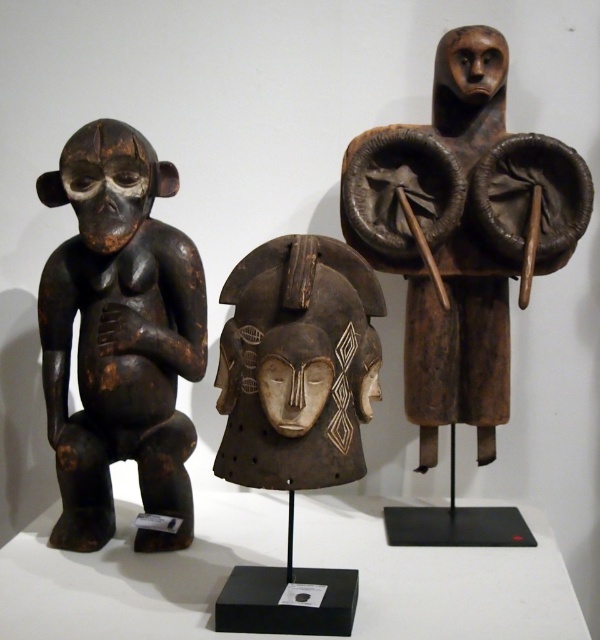
Locate an element on the screen. The image size is (600, 640). brown wooden figure at upper right is located at coordinates (462, 257).

Is point (459, 67) positioned behind point (289, 387)?

Yes.

Measure the distance between brown wooden figure at upper right and camera.

5.04 feet

Locate an element on the screen. Image resolution: width=600 pixels, height=640 pixels. brown wooden figure at upper right is located at coordinates (462, 257).

Is point (445, 531) behind point (69, 188)?

Yes, it is behind point (69, 188).

Is point (411, 152) more distant than point (102, 289)?

Yes, point (411, 152) is farther from viewer.

Locate an element on the screen. Image resolution: width=600 pixels, height=640 pixels. brown wooden figure at upper right is located at coordinates (462, 257).

Does point (126, 428) come in front of point (282, 429)?

That is False.

Can you confirm if dark brown wood figure at left is shorter than dark brown wood mask at center?

In fact, dark brown wood figure at left may be taller than dark brown wood mask at center.

Does point (109, 348) lie in front of point (352, 429)?

No, it is behind (352, 429).

Where is `dark brown wood figure at left`? This screenshot has height=640, width=600. dark brown wood figure at left is located at coordinates (120, 337).